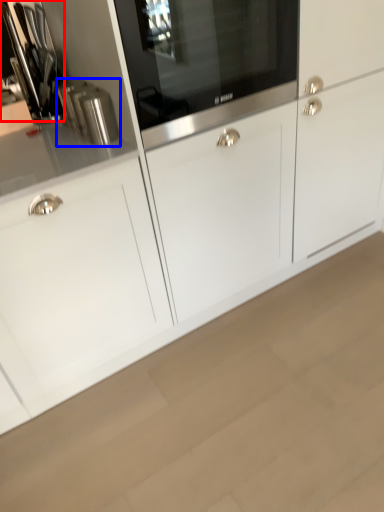
Question: Among these objects, which one is nearest to the camera, appliance (highlighted by a red box) or kitchen appliance (highlighted by a blue box)?

Choices:
 (A) appliance
 (B) kitchen appliance

Answer: (B)